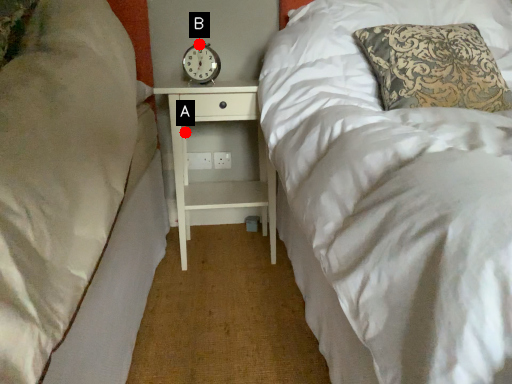
Question: Two points are circled on the image, labeled by A and B beside each circle. Which point is closer to the camera taking this photo?

Choices:
 (A) A is closer
 (B) B is closer

Answer: (A)